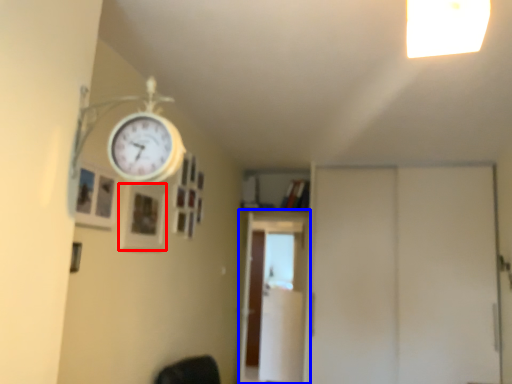
Question: Which object appears closest to the camera in this image, picture frame (highlighted by a red box) or screen door (highlighted by a blue box)?

Choices:
 (A) picture frame
 (B) screen door

Answer: (A)